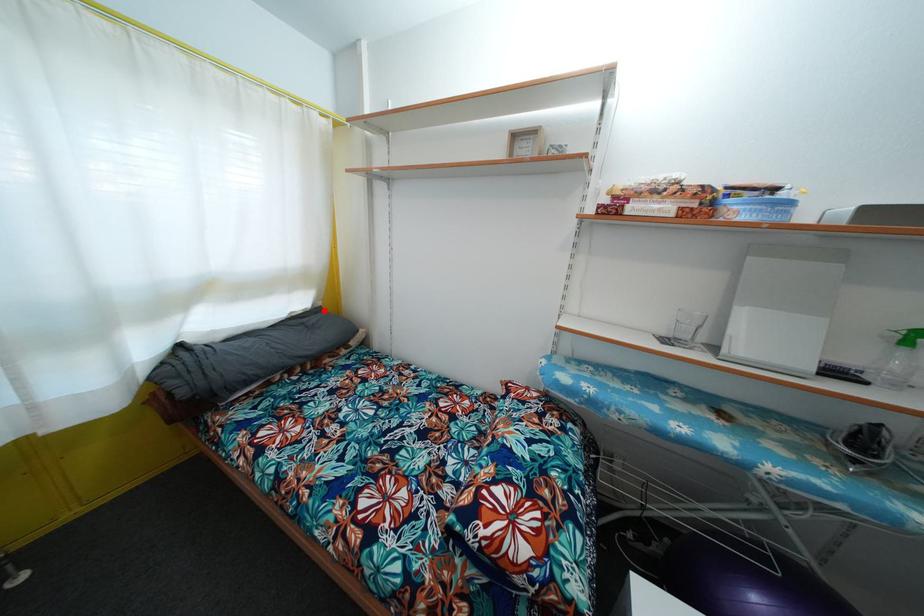
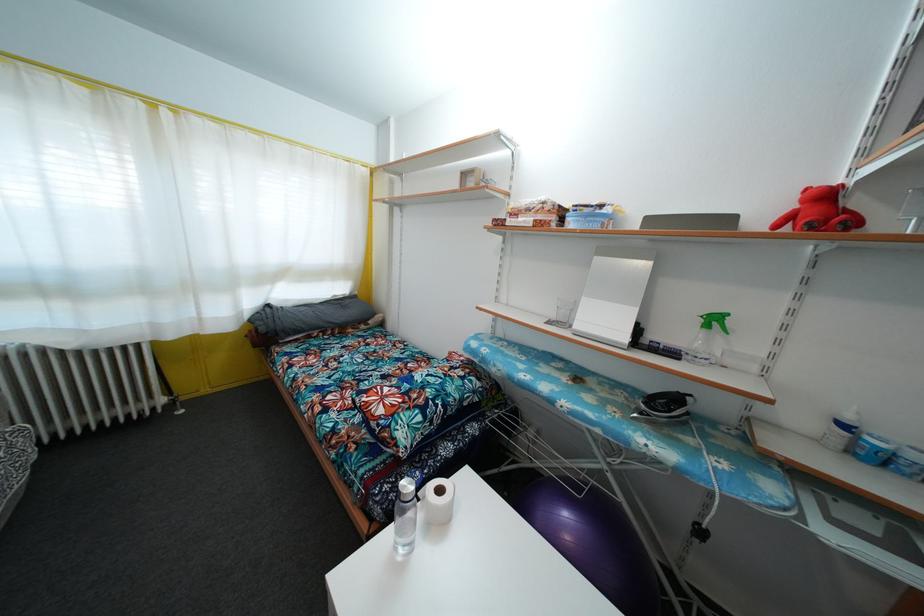
Where in the second image is the point corresponding to the highlighted location from the first image?

(359, 300)